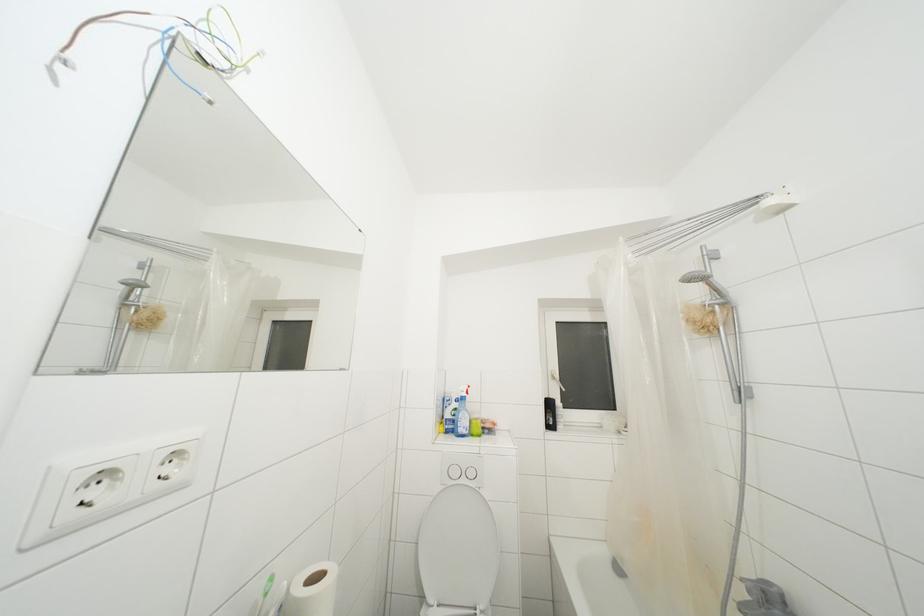
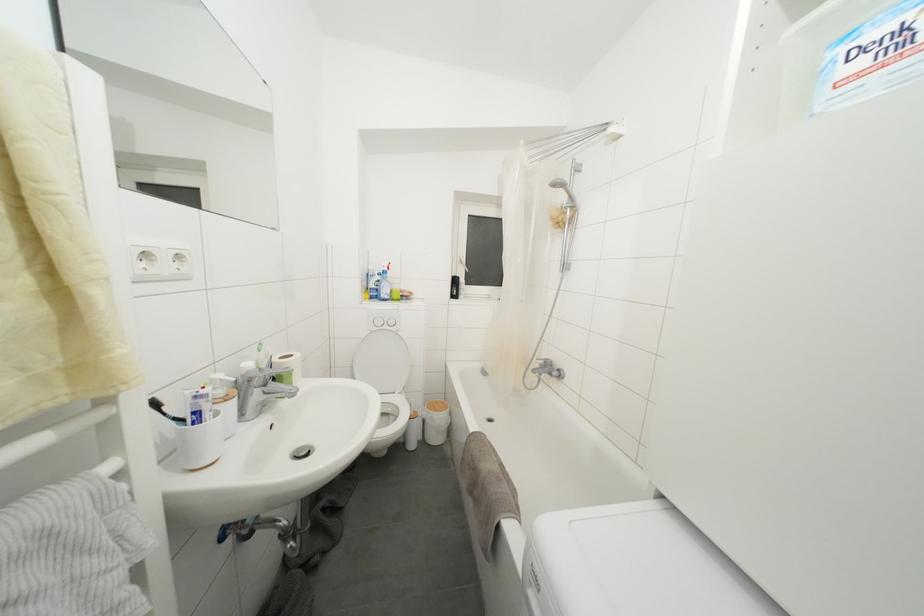
Find the pixel in the second image that matches the point at 455,432 in the first image.

(379, 300)